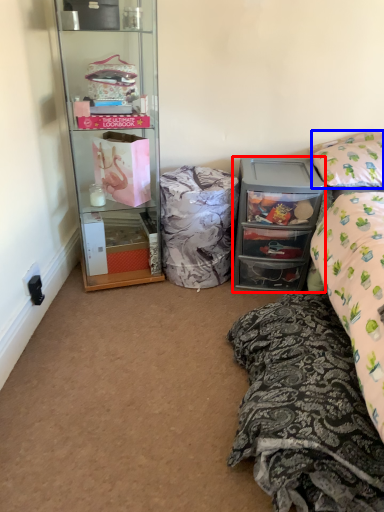
Question: Which object appears closest to the camera in this image, cabinetry (highlighted by a red box) or pillow (highlighted by a blue box)?

Choices:
 (A) cabinetry
 (B) pillow

Answer: (B)